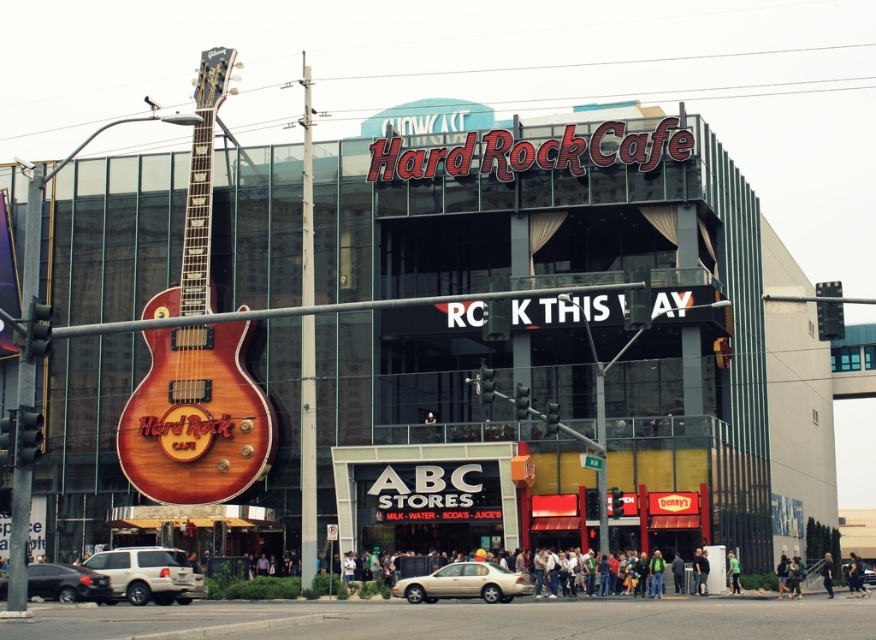
Is beige matte sedan at center in front of shiny black sedan at lower left?

No.

Which is above, beige matte sedan at center or shiny black sedan at lower left?

shiny black sedan at lower left is higher up.

At what (x,y) coordinates should I click in order to perform the action: click on beige matte sedan at center. Please return your answer as a coordinate pair (x, y). Looking at the image, I should click on (464, 582).

Locate an element on the screen. beige matte sedan at center is located at coordinates (464, 582).

Is silver metallic suv at lower left to the left of beige matte sedan at center from the viewer's perspective?

Correct, you'll find silver metallic suv at lower left to the left of beige matte sedan at center.

Is the position of silver metallic suv at lower left less distant than that of beige matte sedan at center?

Yes, silver metallic suv at lower left is closer to the viewer.

Is point (186, 588) closer to viewer compared to point (428, 593)?

Yes, it is in front of point (428, 593).

You are a GUI agent. You are given a task and a screenshot of the screen. Output one action in this format:
    pyautogui.click(x=<x>, y=<y>)
    Task: Click on the silver metallic suv at lower left
    The image size is (876, 640).
    Given the screenshot: What is the action you would take?
    pyautogui.click(x=146, y=573)

Can you confirm if wooden guitar at left is smaller than beige matte sedan at center?

Incorrect, wooden guitar at left is not smaller in size than beige matte sedan at center.

Is point (244, 390) behind point (493, 584)?

Yes, point (244, 390) is behind point (493, 584).

Looking at this image, who is more distant from viewer, (175, 298) or (479, 561)?

Positioned behind is point (175, 298).

Locate an element on the screen. wooden guitar at left is located at coordinates (195, 417).